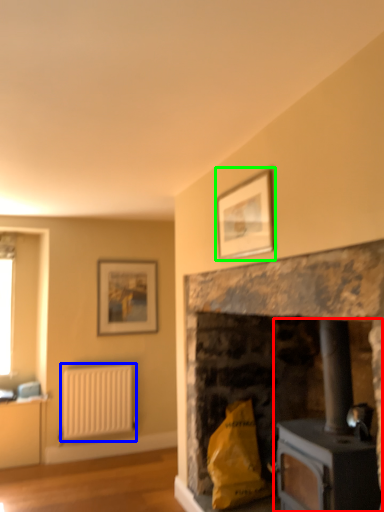
Question: Which object is positioned closest to wood burning stove (highlighted by a red box)? Select from radiator (highlighted by a blue box) and picture frame (highlighted by a green box).

Choices:
 (A) radiator
 (B) picture frame

Answer: (B)